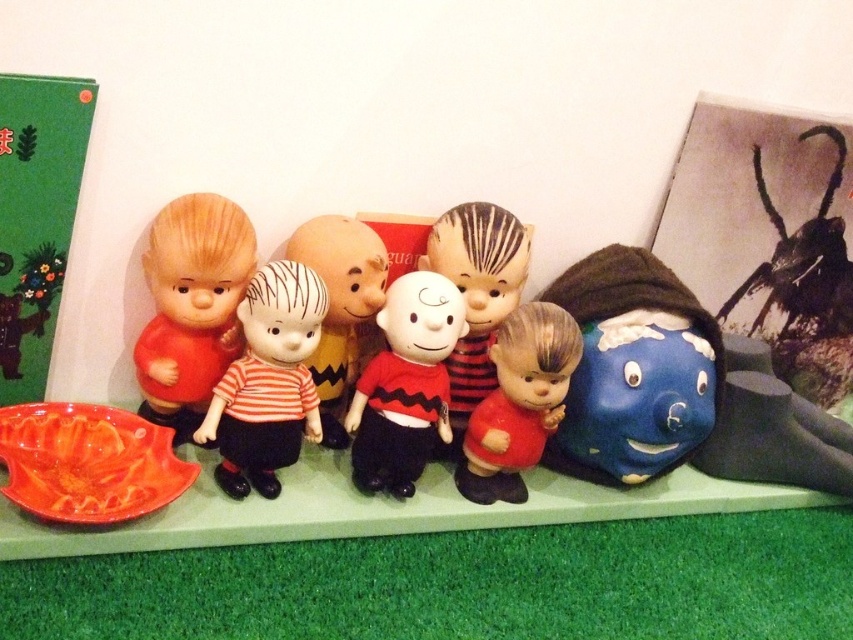
Question: Considering the real-world distances, which object is closest to the striped fabric doll at center?

Choices:
 (A) matte plastic doll at center
 (B) matte orange platter at lower left
 (C) matte plastic child at center
 (D) blue matte head at right

Answer: (B)

Question: Which point is closer to the camera?

Choices:
 (A) matte plastic charlie brown doll at center
 (B) striped fabric doll at center
 (C) matte plastic doll at center

Answer: (B)

Question: Which point is closer to the camera?

Choices:
 (A) (422, 257)
 (B) (392, 321)

Answer: (B)

Question: Observing the image, what is the correct spatial positioning of blue matte head at right in reference to matte plastic doll at center?

Choices:
 (A) left
 (B) right

Answer: (B)

Question: Does blue matte head at right have a smaller size compared to matte plastic child at center?

Choices:
 (A) no
 (B) yes

Answer: (A)

Question: Can you confirm if matte plastic doll at left is thinner than matte plastic child at center?

Choices:
 (A) no
 (B) yes

Answer: (A)